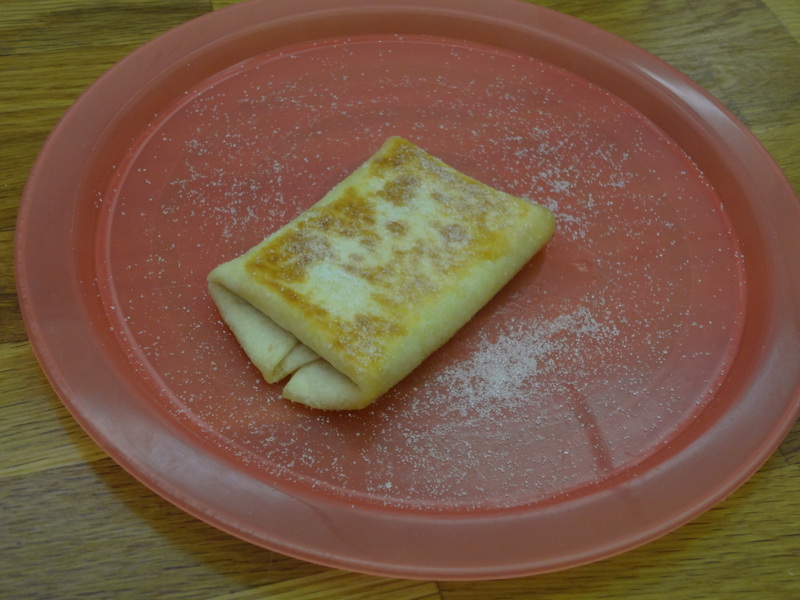
Image resolution: width=800 pixels, height=600 pixels. In order to click on table in this screenshot , I will do `click(146, 543)`.